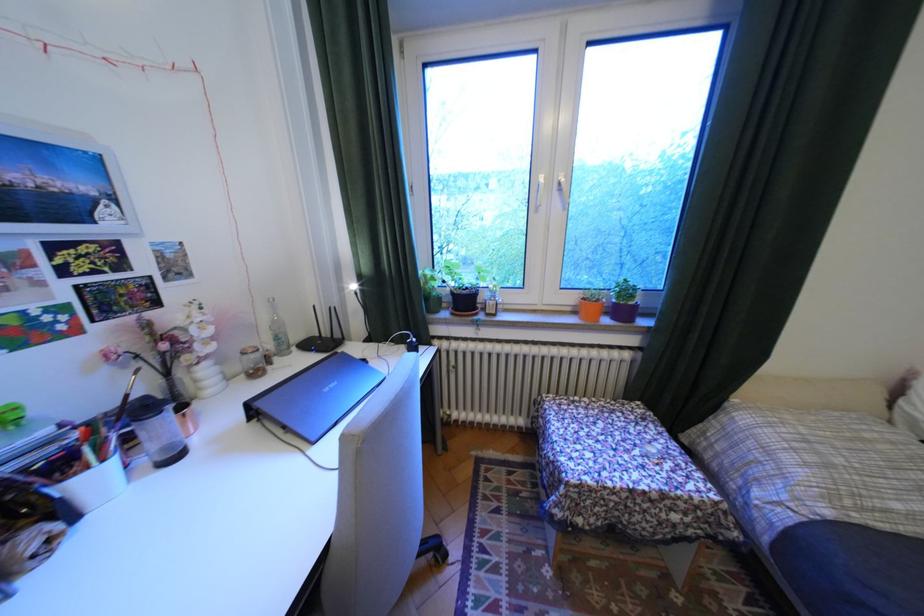
Find where to lift the white vase. Please return your answer as a coordinate pair (x, y).

(94, 485)